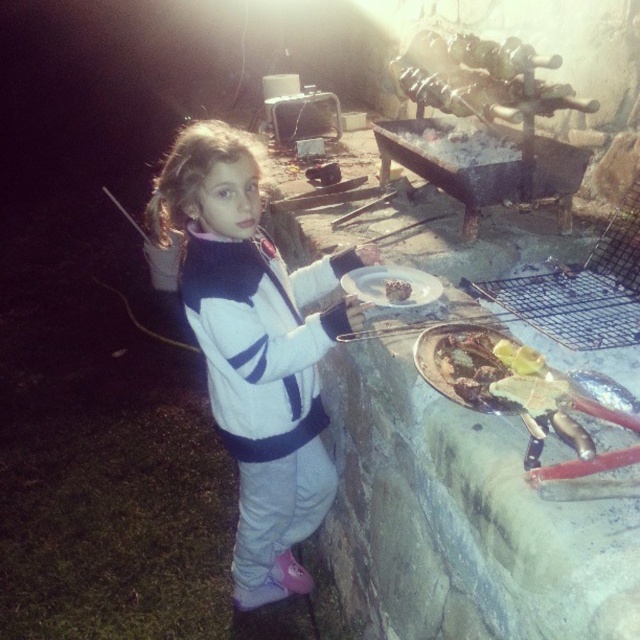
You are a chef holding a spatula and need to transfer a piece of meat from the grill to a plate. The two plates available are the white matte plate at center and the white matte plate at upper center. Which plate is closer to the grill?

The white matte plate at center is closer to the grill than the white matte plate at upper center since the distance between them is 2.73 inches.

You are a photographer trying to capture the scene with the white fleece jacket at center and the white matte plate at center. Which object should you adjust your camera focus on first if you want to ensure both are in focus, considering their positions?

Since the white fleece jacket at center is to the left of the white matte plate at center, you should focus on the white fleece jacket at center first as it is closer to the camera.

You are a photographer setting up for a night shoot. You have a white fleece jacket at center and a white matte plate at center in the scene. Which object should you focus on first if you want to capture the one that is taller?

The white fleece jacket at center is much taller than the white matte plate at center, so you should focus on the white fleece jacket at center first.